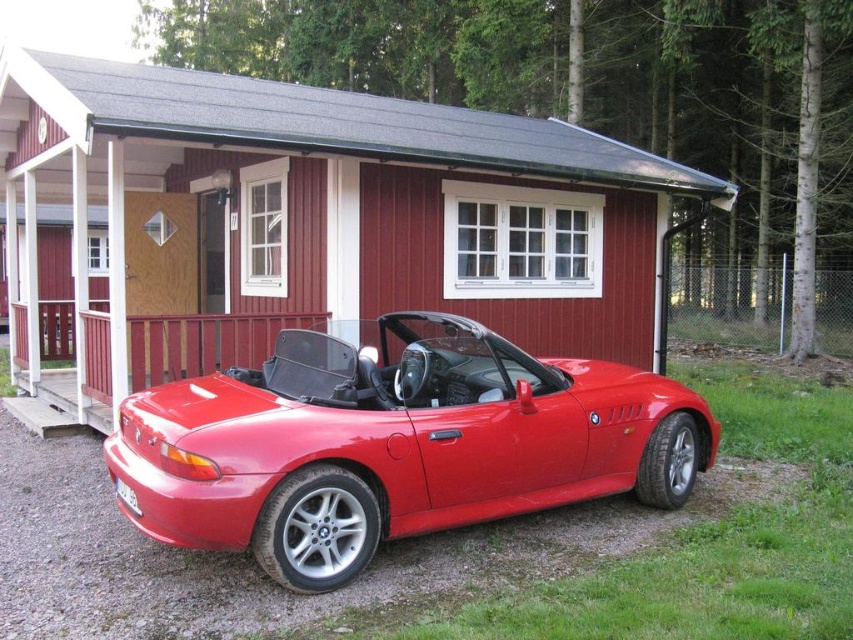
From the picture: Does red wood cabin at center have a lesser width compared to shiny red convertible at center?

Incorrect, red wood cabin at center's width is not less than shiny red convertible at center's.

Does red wood cabin at center have a larger size compared to shiny red convertible at center?

Yes, red wood cabin at center is bigger than shiny red convertible at center.

Which is in front, point (502, 272) or point (169, 424)?

Positioned in front is point (169, 424).

Identify the location of red wood cabin at center. The width and height of the screenshot is (853, 640). (305, 224).

Is the position of shiny red convertible at center more distant than that of wooden railing at lower left?

That is False.

Is shiny red convertible at center to the left of wooden railing at lower left from the viewer's perspective?

No, shiny red convertible at center is not to the left of wooden railing at lower left.

The image size is (853, 640). In order to click on shiny red convertible at center in this screenshot , I will do `click(393, 444)`.

This screenshot has height=640, width=853. Find the location of `shiny red convertible at center`. shiny red convertible at center is located at coordinates (393, 444).

Locate an element on the screen. This screenshot has height=640, width=853. red wood cabin at center is located at coordinates pyautogui.click(x=305, y=224).

Which is below, red wood cabin at center or wooden railing at lower left?

wooden railing at lower left

You are a GUI agent. You are given a task and a screenshot of the screen. Output one action in this format:
    pyautogui.click(x=<x>, y=<y>)
    Task: Click on the red wood cabin at center
    
    Given the screenshot: What is the action you would take?
    pyautogui.click(x=305, y=224)

Where is `red wood cabin at center`? red wood cabin at center is located at coordinates (305, 224).